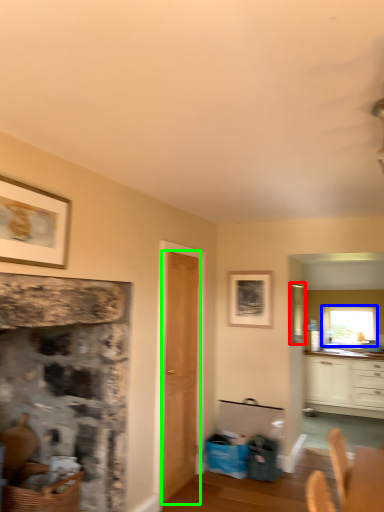
Question: Which object is positioned closest to window screen (highlighted by a red box)? Select from window (highlighted by a blue box) and door (highlighted by a green box).

Choices:
 (A) window
 (B) door

Answer: (A)